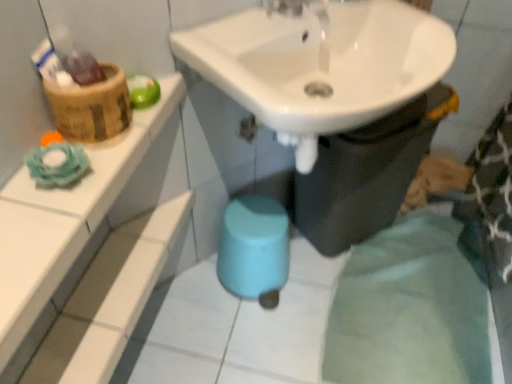
Question: Is white glossy sink at upper center wider than white glossy tile at upper left?

Choices:
 (A) yes
 (B) no

Answer: (A)

Question: Is white glossy tile at upper left at the back of white glossy sink at upper center?

Choices:
 (A) yes
 (B) no

Answer: (B)

Question: From a real-world perspective, is white glossy sink at upper center physically below white glossy tile at upper left?

Choices:
 (A) no
 (B) yes

Answer: (B)

Question: From the image's perspective, is white glossy sink at upper center above white glossy tile at upper left?

Choices:
 (A) yes
 (B) no

Answer: (A)

Question: Is the depth of white glossy sink at upper center less than that of white glossy tile at upper left?

Choices:
 (A) no
 (B) yes

Answer: (A)

Question: From the image's perspective, is white glossy sink at upper center beneath white glossy tile at upper left?

Choices:
 (A) no
 (B) yes

Answer: (A)

Question: Is there a large distance between white glossy tile at upper left and white glossy sink at upper center?

Choices:
 (A) no
 (B) yes

Answer: (A)

Question: Does white glossy tile at upper left have a larger size compared to white glossy sink at upper center?

Choices:
 (A) no
 (B) yes

Answer: (A)

Question: Considering the relative positions of white glossy tile at upper left and white glossy sink at upper center in the image provided, is white glossy tile at upper left behind white glossy sink at upper center?

Choices:
 (A) no
 (B) yes

Answer: (A)

Question: From a real-world perspective, is white glossy tile at upper left positioned under white glossy sink at upper center based on gravity?

Choices:
 (A) yes
 (B) no

Answer: (B)

Question: Is white glossy tile at upper left oriented away from white glossy sink at upper center?

Choices:
 (A) no
 (B) yes

Answer: (A)

Question: Is white glossy tile at upper left completely or partially outside of white glossy sink at upper center?

Choices:
 (A) no
 (B) yes

Answer: (B)

Question: From the image's perspective, would you say white glossy tile at upper left is positioned over wooden basket at upper left?

Choices:
 (A) yes
 (B) no

Answer: (B)